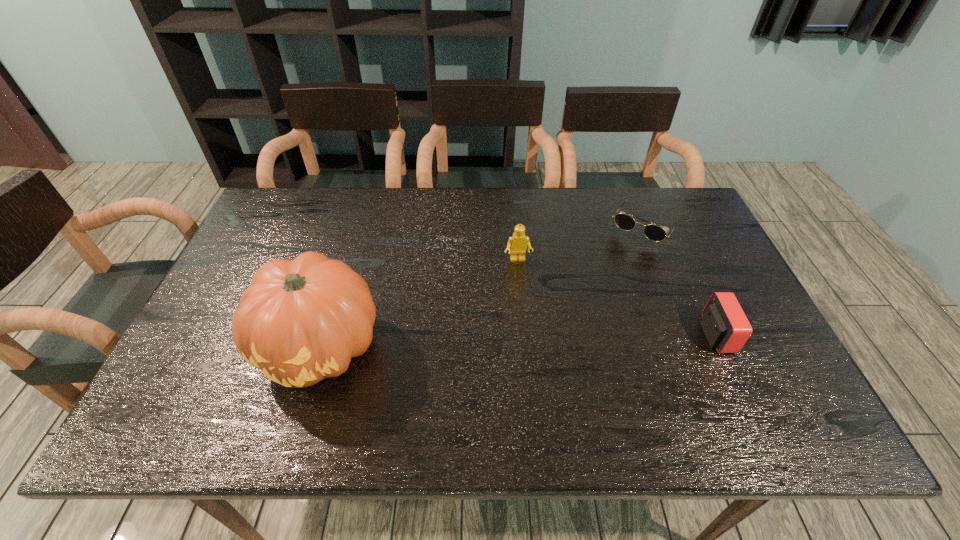
Identify the location of empty location between the farthest object and the alarm clock. The height and width of the screenshot is (540, 960). (680, 281).

Find the location of a particular element. This screenshot has width=960, height=540. empty space that is in between the sunglasses and the alarm clock is located at coordinates (680, 281).

The width and height of the screenshot is (960, 540). I want to click on free spot between the sunglasses and the tallest object, so click(483, 288).

The width and height of the screenshot is (960, 540). In order to click on vacant space in between the tallest object and the farthest object in this screenshot , I will do coord(483,288).

Where is `free space between the sunglasses and the pumpkin`? The width and height of the screenshot is (960, 540). free space between the sunglasses and the pumpkin is located at coordinates click(483, 288).

Locate an element on the screen. Image resolution: width=960 pixels, height=540 pixels. object that stands as the third closest to the alarm clock is located at coordinates (301, 321).

Where is `object identified as the third closest to the farthest object`? The width and height of the screenshot is (960, 540). object identified as the third closest to the farthest object is located at coordinates (301, 321).

Where is `free space that satisfies the following two spatial constraints: 1. on the back side of the sunglasses; 2. on the right side of the third shortest object`? free space that satisfies the following two spatial constraints: 1. on the back side of the sunglasses; 2. on the right side of the third shortest object is located at coordinates (516, 228).

The image size is (960, 540). I want to click on blank area in the image that satisfies the following two spatial constraints: 1. on the front side of the alarm clock; 2. on the front-facing side of the third shortest object, so click(x=524, y=335).

You are a GUI agent. You are given a task and a screenshot of the screen. Output one action in this format:
    pyautogui.click(x=<x>, y=<y>)
    Task: Click on the vacant region that satisfies the following two spatial constraints: 1. on the front side of the farthest object; 2. on the front-facing side of the alarm clock
    The width and height of the screenshot is (960, 540).
    Given the screenshot: What is the action you would take?
    pyautogui.click(x=686, y=335)